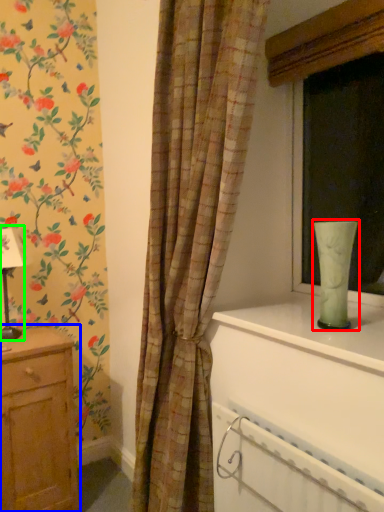
Question: Considering the real-world distances, which object is closest to glass vase (highlighted by a red box)? chest of drawers (highlighted by a blue box) or table lamp (highlighted by a green box).

Choices:
 (A) chest of drawers
 (B) table lamp

Answer: (A)